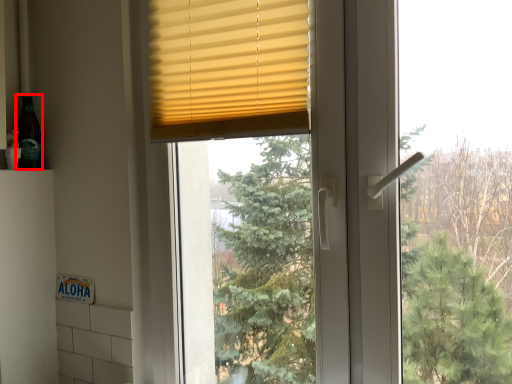
Question: Observing the image, what is the correct spatial positioning of bottle (annotated by the red box) in reference to window blind?

Choices:
 (A) left
 (B) right

Answer: (A)